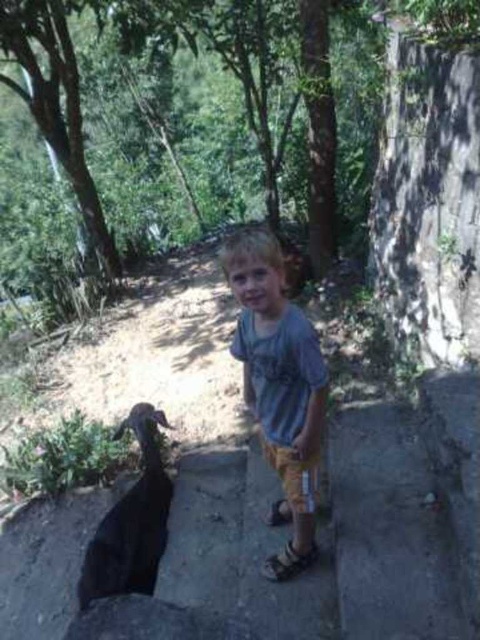
Between light blue cotton shirt at center and black matte goat at lower left, which one is positioned higher?

light blue cotton shirt at center is above.

Is point (261, 384) farther from camera compared to point (154, 461)?

That is False.

Where is `light blue cotton shirt at center`? The height and width of the screenshot is (640, 480). light blue cotton shirt at center is located at coordinates (278, 385).